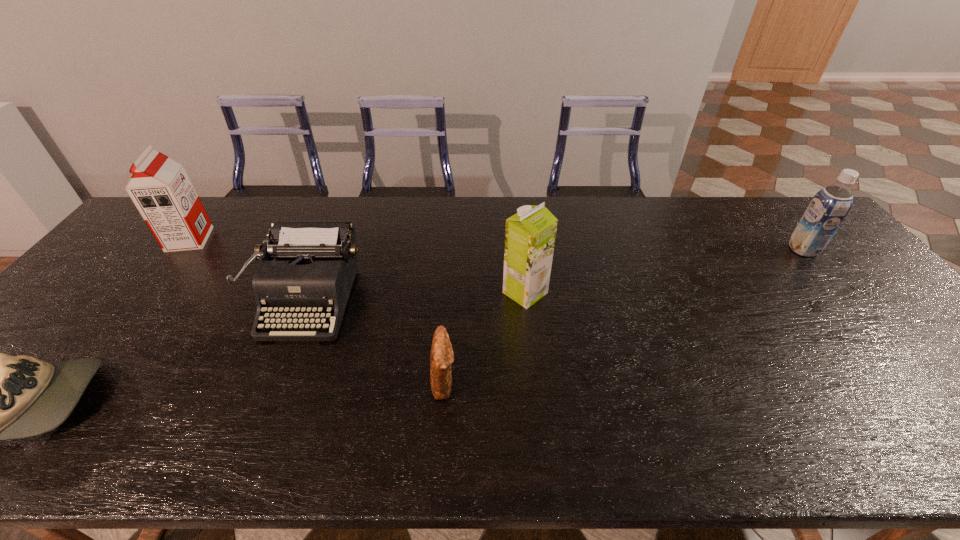
I want to click on vacant space located on the label of the rightmost soya milk, so click(x=715, y=249).

Where is `vacant space located 0.080m on the label of the rightmost soya milk`? vacant space located 0.080m on the label of the rightmost soya milk is located at coordinates (764, 249).

The width and height of the screenshot is (960, 540). I want to click on vacant area situated 0.310m on the label of the rightmost soya milk, so click(x=689, y=249).

Image resolution: width=960 pixels, height=540 pixels. What are the coordinates of `vacant position located on the front-facing side of the typewriter` in the screenshot? It's located at (255, 435).

Find the location of a particular element. This screenshot has width=960, height=540. free space located 0.240m on the open side of the clutch bag is located at coordinates (561, 381).

This screenshot has width=960, height=540. In order to click on object positioned at the far edge in this screenshot , I will do `click(160, 188)`.

Identify the location of object at the left edge. (160, 188).

The height and width of the screenshot is (540, 960). I want to click on object that is positioned at the right edge, so click(x=829, y=207).

The image size is (960, 540). I want to click on object that is at the far left corner, so click(x=160, y=188).

The width and height of the screenshot is (960, 540). Find the location of `vacant space at the far edge of the desktop`. vacant space at the far edge of the desktop is located at coordinates (650, 202).